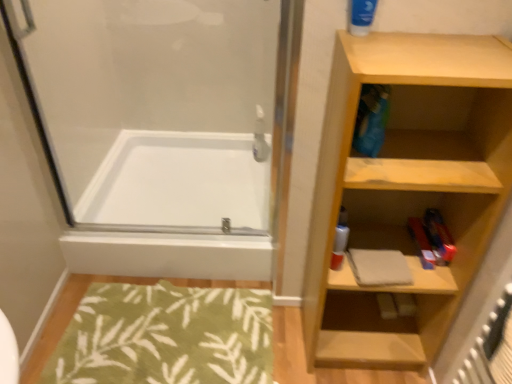
Question: From a real-world perspective, is green leafy rug at lower left physically located above or below blue matte tube at upper right?

Choices:
 (A) above
 (B) below

Answer: (B)

Question: Considering the positions of point (236, 357) and point (361, 34), is point (236, 357) closer or farther from the camera than point (361, 34)?

Choices:
 (A) farther
 (B) closer

Answer: (A)

Question: Estimate the real-world distances between objects in this image. Which object is farther from the white glossy bathtub at center?

Choices:
 (A) blue matte tube at upper right
 (B) green leafy rug at lower left
 (C) wooden shelf at right
 (D) transparent glass shower door at upper left

Answer: (A)

Question: Which of these objects is positioned farthest from the green leafy rug at lower left?

Choices:
 (A) white glossy bathtub at center
 (B) wooden shelf at right
 (C) transparent glass shower door at upper left
 (D) blue matte tube at upper right

Answer: (D)